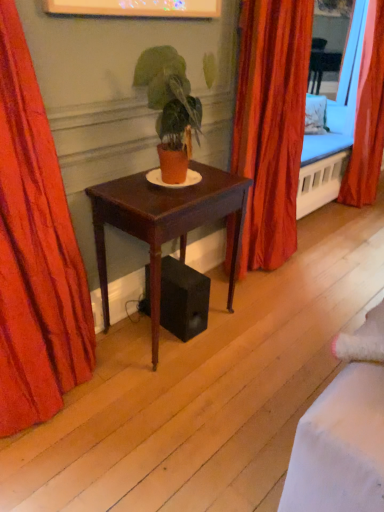
Locate an element on the screen. The width and height of the screenshot is (384, 512). free space in front of velvet red curtain at left, the first curtain in the left-to-right sequence is located at coordinates click(x=58, y=460).